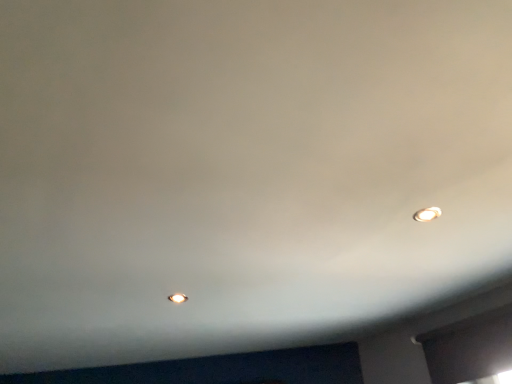
Question: Based on their positions, is transparent glass window at lower right located to the left or right of matte white light bulb at upper right, which is the 2th light bulb in left-to-right order?

Choices:
 (A) right
 (B) left

Answer: (A)

Question: Is transparent glass window at lower right taller or shorter than matte white light bulb at upper right, which appears as the second light bulb when ordered from the bottom?

Choices:
 (A) tall
 (B) short

Answer: (A)

Question: Which is nearer to the matte white light bulb at upper right, which appears as the second light bulb when ordered from the bottom?

Choices:
 (A) matte white light bulb at center, which is the second light bulb in right-to-left order
 (B) transparent glass window at lower right

Answer: (B)

Question: Which of these objects is positioned farthest from the transparent glass window at lower right?

Choices:
 (A) matte white light bulb at center, the 1th light bulb positioned from the back
 (B) matte white light bulb at upper right, which appears as the second light bulb when ordered from the bottom

Answer: (A)